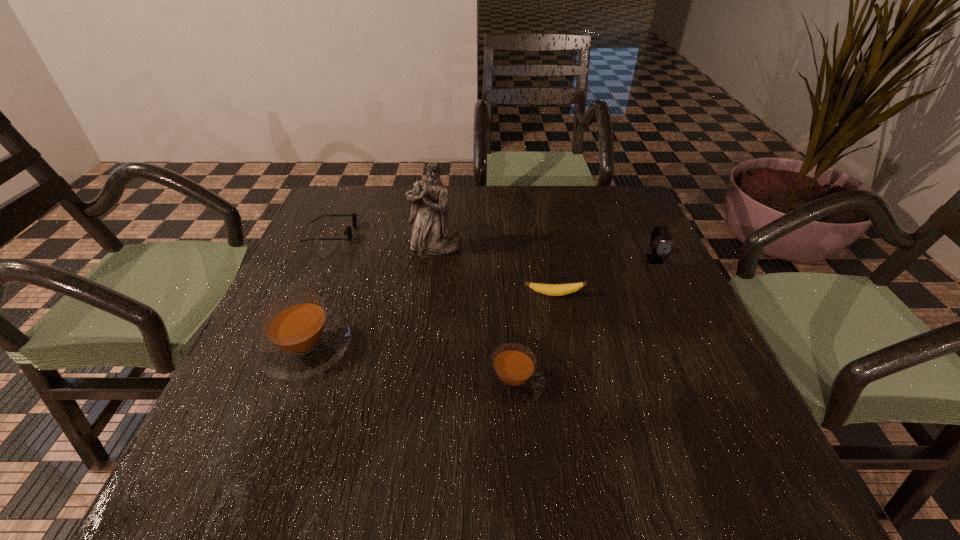
You are a GUI agent. You are given a task and a screenshot of the screen. Output one action in this format:
    pyautogui.click(x=<x>, y=<y>)
    Task: Click on the free space for a new cappuccino on the right
    The image size is (960, 540).
    Given the screenshot: What is the action you would take?
    pyautogui.click(x=752, y=420)